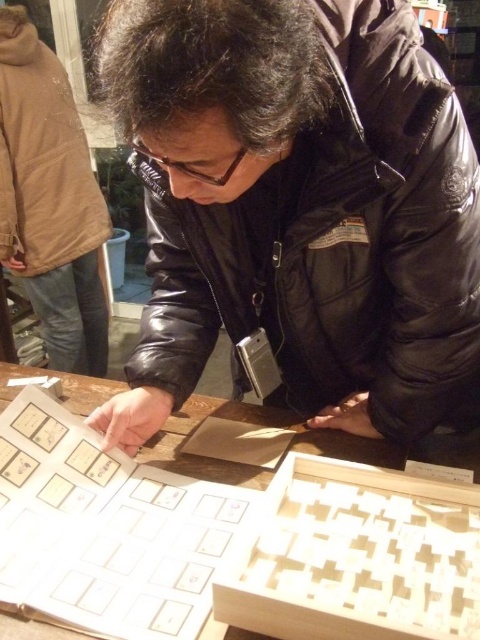
Which of these two, black leather jacket at center or wooden table at center, stands taller?

black leather jacket at center

Is point (384, 38) more distant than point (262, 412)?

That is False.

You are a GUI agent. You are given a task and a screenshot of the screen. Output one action in this format:
    pyautogui.click(x=<x>, y=<y>)
    Task: Click on the black leather jacket at center
    The width and height of the screenshot is (480, 640).
    Given the screenshot: What is the action you would take?
    pyautogui.click(x=387, y=228)